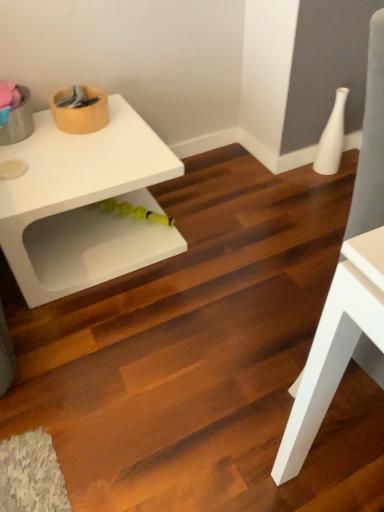
Question: From a real-world perspective, is white matte table at upper left, the second table when ordered from front to back, under white matte table at right, placed as the first table when sorted from front to back?

Choices:
 (A) no
 (B) yes

Answer: (B)

Question: From the image's perspective, is white matte table at upper left, the second table when ordered from front to back, above white matte table at right, which ranks as the first table in right-to-left order?

Choices:
 (A) yes
 (B) no

Answer: (A)

Question: Does white matte table at upper left, which is the second table from right to left, have a smaller size compared to white matte table at right, which is counted as the second table, starting from the left?

Choices:
 (A) yes
 (B) no

Answer: (B)

Question: Considering the relative sizes of white matte table at upper left, which is the second table from right to left, and white matte table at right, placed as the first table when sorted from front to back, in the image provided, is white matte table at upper left, which is the second table from right to left, thinner than white matte table at right, placed as the first table when sorted from front to back,?

Choices:
 (A) no
 (B) yes

Answer: (A)

Question: Is white matte table at upper left, which is the 1th table in left-to-right order, closer to camera compared to white matte table at right, which ranks as the first table in right-to-left order?

Choices:
 (A) yes
 (B) no

Answer: (B)

Question: Considering the positions of point (342, 140) and point (329, 344), is point (342, 140) closer or farther from the camera than point (329, 344)?

Choices:
 (A) farther
 (B) closer

Answer: (A)

Question: Looking at their shapes, would you say white glossy vase at upper right is wider or thinner than white matte table at right, which is counted as the second table, starting from the left?

Choices:
 (A) wide
 (B) thin

Answer: (B)

Question: From the image's perspective, is white glossy vase at upper right located above or below white matte table at right, placed as the first table when sorted from front to back?

Choices:
 (A) above
 (B) below

Answer: (A)

Question: Is white glossy vase at upper right in front of or behind white matte table at right, which ranks as the first table in right-to-left order, in the image?

Choices:
 (A) front
 (B) behind

Answer: (B)

Question: From a real-world perspective, is white glossy vase at upper right above or below white matte table at upper left, the second table when ordered from front to back?

Choices:
 (A) above
 (B) below

Answer: (B)

Question: Is white glossy vase at upper right inside the boundaries of white matte table at upper left, which is the 1th table in left-to-right order, or outside?

Choices:
 (A) outside
 (B) inside

Answer: (A)

Question: Considering the positions of white glossy vase at upper right and white matte table at upper left, which is the 1th table in left-to-right order, in the image, is white glossy vase at upper right bigger or smaller than white matte table at upper left, which is the 1th table in left-to-right order,?

Choices:
 (A) small
 (B) big

Answer: (A)

Question: Considering the positions of white glossy vase at upper right and white matte table at upper left, the second table when ordered from front to back, in the image, is white glossy vase at upper right taller or shorter than white matte table at upper left, the second table when ordered from front to back,?

Choices:
 (A) short
 (B) tall

Answer: (A)

Question: In terms of width, does white matte table at upper left, the second table when ordered from front to back, look wider or thinner when compared to white glossy vase at upper right?

Choices:
 (A) wide
 (B) thin

Answer: (A)

Question: In the image, is white matte table at upper left, the second table when ordered from front to back, positioned in front of or behind white glossy vase at upper right?

Choices:
 (A) front
 (B) behind

Answer: (A)